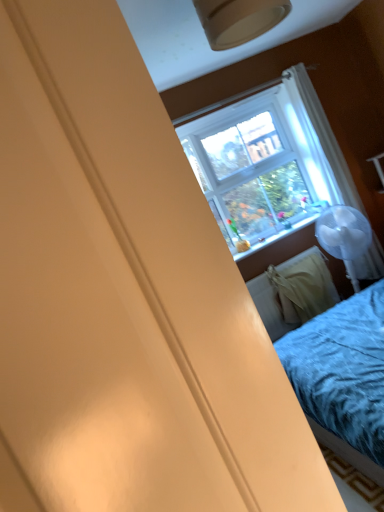
Question: In terms of height, does white fabric radiator at lower right look taller or shorter compared to matte plastic window sill at center?

Choices:
 (A) tall
 (B) short

Answer: (A)

Question: From a real-world perspective, is white fabric radiator at lower right physically located above or below matte plastic window sill at center?

Choices:
 (A) above
 (B) below

Answer: (B)

Question: Estimate the real-world distances between objects in this image. Which object is closer to the matte plastic window sill at center?

Choices:
 (A) white sheer curtain at upper right
 (B) white fabric radiator at lower right

Answer: (B)

Question: Considering the real-world distances, which object is closest to the matte plastic window sill at center?

Choices:
 (A) white sheer curtain at upper right
 (B) white fabric radiator at lower right

Answer: (B)